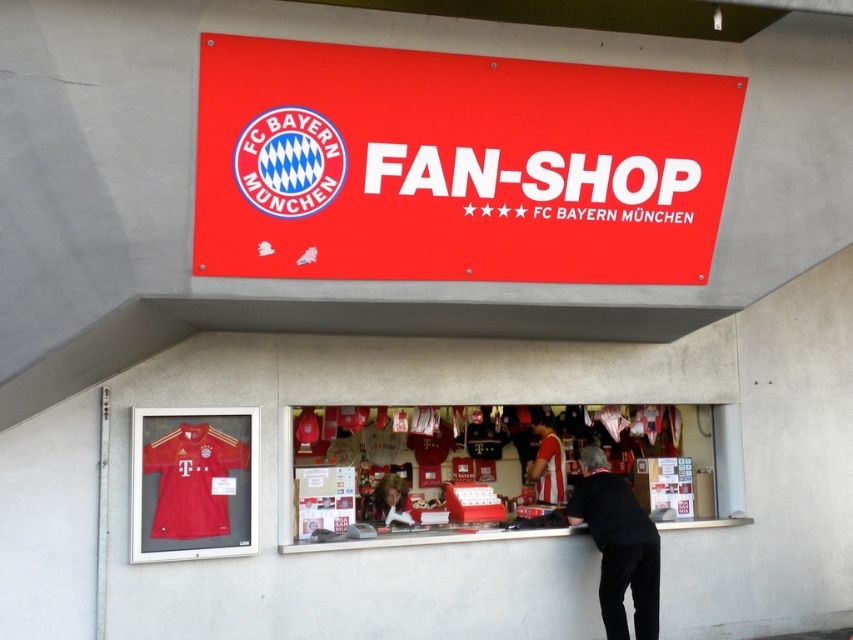
You are a customer looking at the matte jersey at center in the FC Bayern shop. You want to hang a similar sign above it. Is the current red matte sign at upper center already placed above the jersey?

The red matte sign at upper center is positioned over matte jersey at center, so yes, the current red matte sign at upper center is already placed above the matte jersey at center.